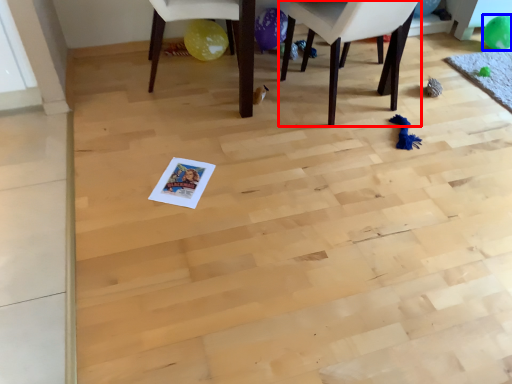
Question: Which point is closer to the camera, chair (highlighted by a red box) or balloon (highlighted by a blue box)?

Choices:
 (A) chair
 (B) balloon

Answer: (A)